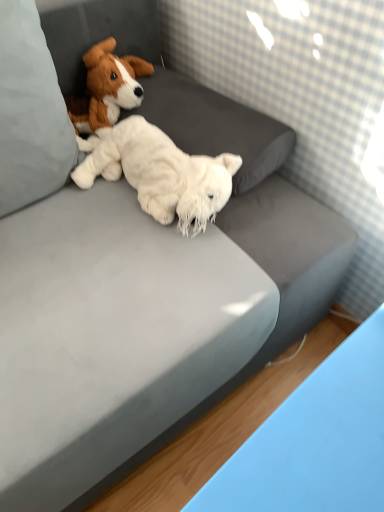
Find the location of a particular element. The image size is (384, 512). brown plush dog at upper left, placed as the 2th dog when sorted from bottom to top is located at coordinates (107, 88).

From a real-world perspective, is white fluffy stuffed animal at center, which ranks as the 1th dog in bottom-to-top order, under brown plush dog at upper left, acting as the first dog starting from the top?

Correct, in the physical world, white fluffy stuffed animal at center, which ranks as the 1th dog in bottom-to-top order, is lower than brown plush dog at upper left, acting as the first dog starting from the top.

Is point (172, 155) in front of point (106, 84)?

Yes, it is.

In the scene shown: Does white fluffy stuffed animal at center, the second dog when ordered from top to bottom, appear on the right side of brown plush dog at upper left, acting as the first dog starting from the top?

Yes.

Considering the relative sizes of white fluffy stuffed animal at center, which ranks as the 1th dog in bottom-to-top order, and brown plush dog at upper left, placed as the 2th dog when sorted from bottom to top, in the image provided, is white fluffy stuffed animal at center, which ranks as the 1th dog in bottom-to-top order, smaller than brown plush dog at upper left, placed as the 2th dog when sorted from bottom to top,?

No.

Is brown plush dog at upper left, acting as the first dog starting from the top, positioned far away from white soft pillow at upper left?

No, brown plush dog at upper left, acting as the first dog starting from the top, is not far away from white soft pillow at upper left.

What's the angular difference between brown plush dog at upper left, acting as the first dog starting from the top, and white soft pillow at upper left's facing directions?

They differ by 0.000743 degrees in their facing directions.

Who is shorter, brown plush dog at upper left, acting as the first dog starting from the top, or white soft pillow at upper left?

Standing shorter between the two is brown plush dog at upper left, acting as the first dog starting from the top.

From a real-world perspective, is brown plush dog at upper left, acting as the first dog starting from the top, physically located above or below white soft pillow at upper left?

brown plush dog at upper left, acting as the first dog starting from the top, is situated lower than white soft pillow at upper left in the real world.

What's the angular difference between white soft pillow at upper left and white fluffy stuffed animal at center, the second dog when ordered from top to bottom,'s facing directions?

They differ by 71.6 degrees in their facing directions.

Who is taller, white soft pillow at upper left or white fluffy stuffed animal at center, which ranks as the 1th dog in bottom-to-top order?

With more height is white soft pillow at upper left.

Can you confirm if white soft pillow at upper left is smaller than white fluffy stuffed animal at center, which ranks as the 1th dog in bottom-to-top order?

No, white soft pillow at upper left is not smaller than white fluffy stuffed animal at center, which ranks as the 1th dog in bottom-to-top order.

Does white fluffy stuffed animal at center, which ranks as the 1th dog in bottom-to-top order, have a smaller size compared to white soft pillow at upper left?

Yes.

What's the angular difference between white fluffy stuffed animal at center, the second dog when ordered from top to bottom, and white soft pillow at upper left's facing directions?

white fluffy stuffed animal at center, the second dog when ordered from top to bottom, and white soft pillow at upper left are facing 71.6 degrees away from each other.

Which is more to the right, white fluffy stuffed animal at center, which ranks as the 1th dog in bottom-to-top order, or white soft pillow at upper left?

Positioned to the right is white fluffy stuffed animal at center, which ranks as the 1th dog in bottom-to-top order.

Is white fluffy stuffed animal at center, the second dog when ordered from top to bottom, oriented towards white soft pillow at upper left?

No, white fluffy stuffed animal at center, the second dog when ordered from top to bottom, is not facing towards white soft pillow at upper left.

Between white soft pillow at upper left and brown plush dog at upper left, acting as the first dog starting from the top, which one has smaller size?

With smaller size is brown plush dog at upper left, acting as the first dog starting from the top.

In the image, there is a brown plush dog at upper left, placed as the 2th dog when sorted from bottom to top. At what (x,y) coordinates should I click in order to perform the action: click on pillow below it (from the image's perspective). Please return your answer as a coordinate pair (x, y). Looking at the image, I should click on (30, 112).

How many degrees apart are the facing directions of white soft pillow at upper left and brown plush dog at upper left, placed as the 2th dog when sorted from bottom to top?

The angle between the facing direction of white soft pillow at upper left and the facing direction of brown plush dog at upper left, placed as the 2th dog when sorted from bottom to top, is 0.000743 degrees.

Does point (34, 18) lie in front of point (90, 77)?

That is True.

Considering the relative sizes of brown plush dog at upper left, placed as the 2th dog when sorted from bottom to top, and white fluffy stuffed animal at center, the second dog when ordered from top to bottom, in the image provided, is brown plush dog at upper left, placed as the 2th dog when sorted from bottom to top, taller than white fluffy stuffed animal at center, the second dog when ordered from top to bottom,?

Yes.

Consider the image. From a real-world perspective, is brown plush dog at upper left, acting as the first dog starting from the top, positioned above or below white fluffy stuffed animal at center, which ranks as the 1th dog in bottom-to-top order?

In terms of real-world spatial position, brown plush dog at upper left, acting as the first dog starting from the top, is above white fluffy stuffed animal at center, which ranks as the 1th dog in bottom-to-top order.

Based on the photo, is brown plush dog at upper left, placed as the 2th dog when sorted from bottom to top, touching white fluffy stuffed animal at center, the second dog when ordered from top to bottom?

No, brown plush dog at upper left, placed as the 2th dog when sorted from bottom to top, is not making contact with white fluffy stuffed animal at center, the second dog when ordered from top to bottom.

Does point (127, 89) appear closer or farther from the camera than point (129, 131)?

Point (127, 89).

Identify the location of dog to the right of brown plush dog at upper left, placed as the 2th dog when sorted from bottom to top. This screenshot has height=512, width=384. (159, 173).

At what (x,y) coordinates should I click in order to perform the action: click on pillow below the brown plush dog at upper left, placed as the 2th dog when sorted from bottom to top (from the image's perspective). Please return your answer as a coordinate pair (x, y). The image size is (384, 512). Looking at the image, I should click on (30, 112).

From the image, which object appears to be farther from brown plush dog at upper left, placed as the 2th dog when sorted from bottom to top, white soft pillow at upper left or white fluffy stuffed animal at center, the second dog when ordered from top to bottom?

Based on the image, white soft pillow at upper left appears to be further to brown plush dog at upper left, placed as the 2th dog when sorted from bottom to top.

Based on their spatial positions, is brown plush dog at upper left, acting as the first dog starting from the top, or white soft pillow at upper left further from white fluffy stuffed animal at center, the second dog when ordered from top to bottom?

brown plush dog at upper left, acting as the first dog starting from the top, lies further to white fluffy stuffed animal at center, the second dog when ordered from top to bottom, than the other object.

Estimate the real-world distances between objects in this image. Which object is further from white fluffy stuffed animal at center, which ranks as the 1th dog in bottom-to-top order, white soft pillow at upper left or brown plush dog at upper left, acting as the first dog starting from the top?

brown plush dog at upper left, acting as the first dog starting from the top, lies further to white fluffy stuffed animal at center, which ranks as the 1th dog in bottom-to-top order, than the other object.

Estimate the real-world distances between objects in this image. Which object is closer to white soft pillow at upper left, brown plush dog at upper left, placed as the 2th dog when sorted from bottom to top, or white fluffy stuffed animal at center, the second dog when ordered from top to bottom?

white fluffy stuffed animal at center, the second dog when ordered from top to bottom.

Considering their positions, is white fluffy stuffed animal at center, the second dog when ordered from top to bottom, positioned closer to brown plush dog at upper left, acting as the first dog starting from the top, than white soft pillow at upper left?

white fluffy stuffed animal at center, the second dog when ordered from top to bottom.

Looking at the image, which one is located further to white soft pillow at upper left, white fluffy stuffed animal at center, which ranks as the 1th dog in bottom-to-top order, or brown plush dog at upper left, placed as the 2th dog when sorted from bottom to top?

brown plush dog at upper left, placed as the 2th dog when sorted from bottom to top.

Where is `dog located between white soft pillow at upper left and brown plush dog at upper left, acting as the first dog starting from the top, in the depth direction`? This screenshot has width=384, height=512. dog located between white soft pillow at upper left and brown plush dog at upper left, acting as the first dog starting from the top, in the depth direction is located at coordinates (159, 173).